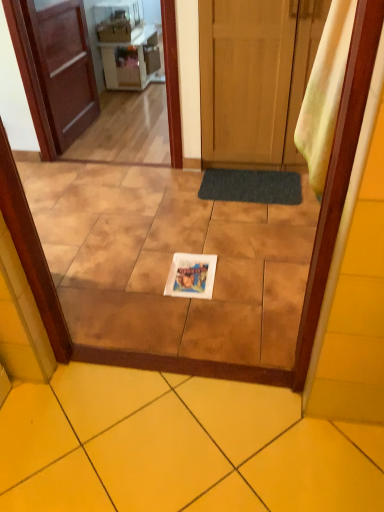
Where is `free space in front of white glossy book at center`? The image size is (384, 512). free space in front of white glossy book at center is located at coordinates (193, 314).